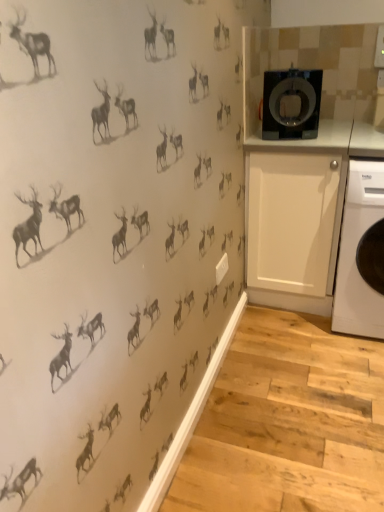
In order to click on free space below black glossy washing machine at upper right (from a real-world perspective) in this screenshot , I will do `click(286, 138)`.